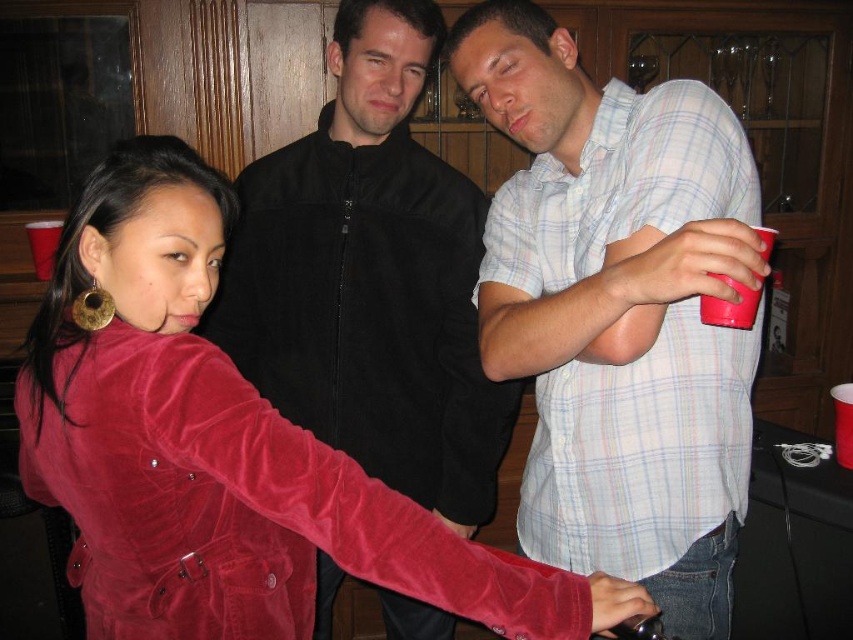
From the picture: Can you confirm if light blue plaid shirt at center is positioned to the right of velvet jacket at center?

Yes, light blue plaid shirt at center is to the right of velvet jacket at center.

Is point (529, 340) positioned behind point (328, 561)?

No, (529, 340) is in front of (328, 561).

What do you see at coordinates (618, 310) in the screenshot? Image resolution: width=853 pixels, height=640 pixels. I see `light blue plaid shirt at center` at bounding box center [618, 310].

I want to click on light blue plaid shirt at center, so click(618, 310).

Does velvet red jacket at center have a lesser height compared to light blue plaid shirt at center?

Indeed, velvet red jacket at center has a lesser height compared to light blue plaid shirt at center.

Image resolution: width=853 pixels, height=640 pixels. I want to click on velvet red jacket at center, so click(219, 448).

Is velvet red jacket at center thinner than velvet jacket at center?

In fact, velvet red jacket at center might be wider than velvet jacket at center.

Which of these two, velvet red jacket at center or velvet jacket at center, stands shorter?

velvet red jacket at center is shorter.

Image resolution: width=853 pixels, height=640 pixels. I want to click on velvet red jacket at center, so click(x=219, y=448).